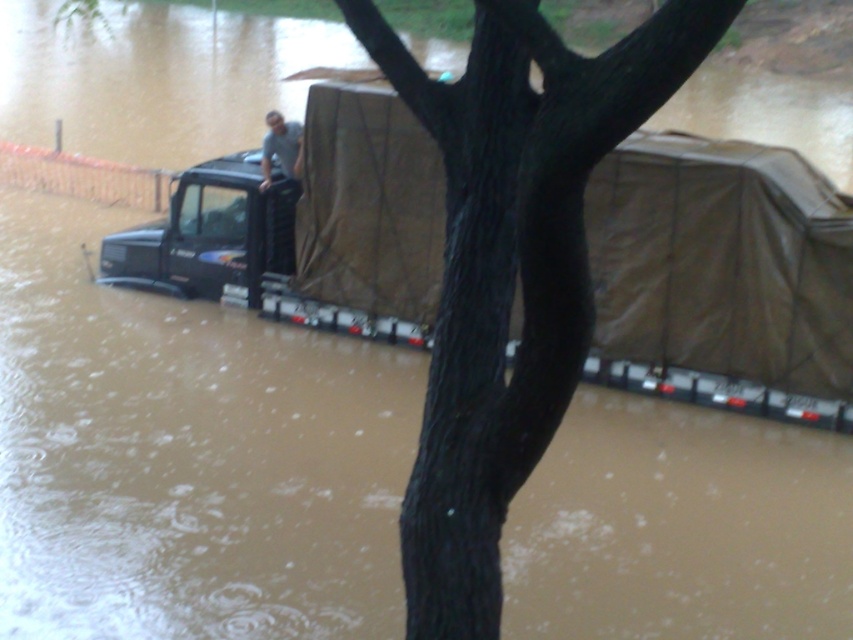
In the scene shown: You are a rescue worker trying to reach the person on the truck. The brown tarpaulin tent at center is blocking your path. Can you move around it to get to the person?

The brown tarpaulin tent at center is located at point (722, 260), so you can move around it to reach the person on the truck since it is not directly in the path between you and the person.

You are a rescue worker trying to reach the person on the gray fabric truck at center. There is a brown tarpaulin tent at center in the way. Can you go around it to reach the truck?

The brown tarpaulin tent at center is positioned under the gray fabric truck at center, so it is located beneath the truck and not blocking the path. You can safely approach the gray fabric truck at center without needing to go around the brown tarpaulin tent at center.

You are a delivery driver who needs to pass through this flooded area. There are two trucks in the image, a matte black truck at left and a gray fabric truck at center. Which truck should you avoid driving near to ensure you have enough space in the flooded area?

You should avoid driving near the matte black truck at left because its width is larger than the gray fabric truck at center, which may leave less space for your vehicle to navigate safely through the flooded area.